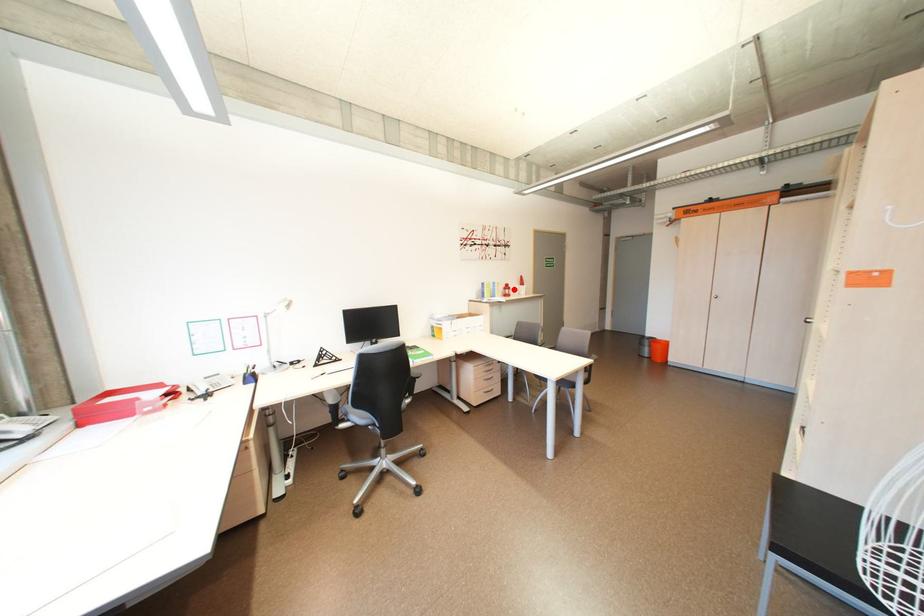
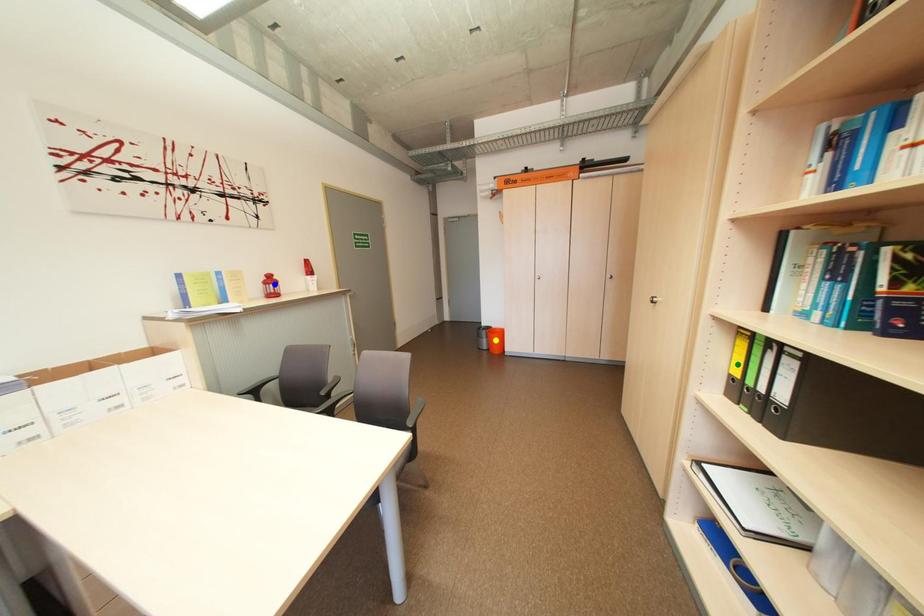
Question: I am providing you with two images of the same scene from different viewpoints. A red point is marked on the first image. You are given multiple points on the second image. Which point in image 2 is actually the same real-world point as the red point in image 1?

Choices:
 (A) green point
 (B) blue point
 (C) yellow point

Answer: (B)